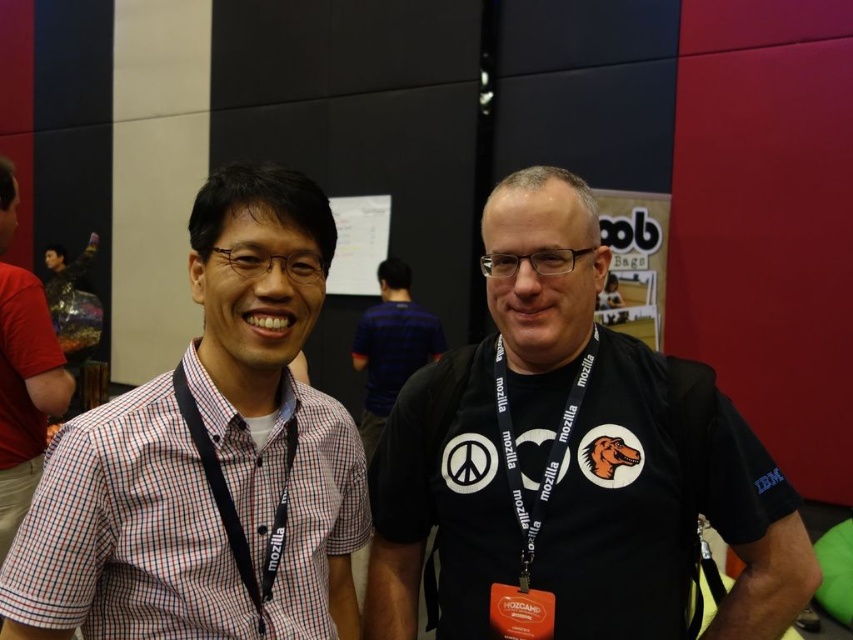
Question: Which object is positioned closest to the blue striped shirt at center?

Choices:
 (A) black fabric lanyard at center
 (B) black fabric lanyard at left
 (C) checkered fabric shirt at left

Answer: (A)

Question: Is the position of black fabric lanyard at left more distant than that of black fabric lanyard at center?

Choices:
 (A) no
 (B) yes

Answer: (A)

Question: Is blue striped shirt at center wider than black fabric lanyard at left?

Choices:
 (A) yes
 (B) no

Answer: (A)

Question: Among these points, which one is nearest to the camera?

Choices:
 (A) (218, 572)
 (B) (218, 499)

Answer: (A)

Question: In this image, where is black matte t-shirt at center located relative to black fabric lanyard at left?

Choices:
 (A) above
 (B) below

Answer: (B)

Question: Which point is farther to the camera?

Choices:
 (A) black matte t-shirt at center
 (B) checkered shirt at left
 (C) checkered fabric shirt at left
 (D) black fabric lanyard at left

Answer: (B)